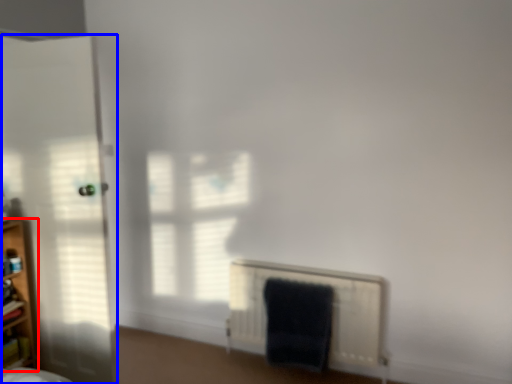
Question: Which of the following is the farthest to the observer, shelf (highlighted by a red box) or door (highlighted by a blue box)?

Choices:
 (A) shelf
 (B) door

Answer: (A)